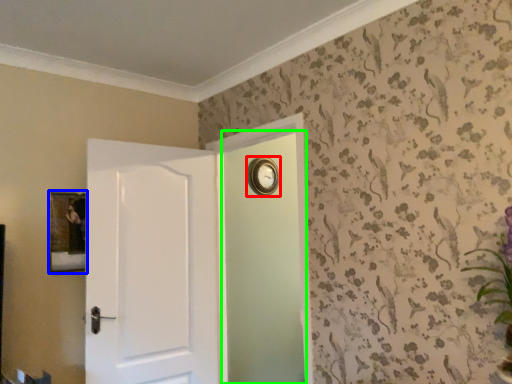
Question: Estimate the real-world distances between objects in this image. Which object is closer to clock (highlighted by a red box), picture frame (highlighted by a blue box) or screen door (highlighted by a green box)?

Choices:
 (A) picture frame
 (B) screen door

Answer: (B)